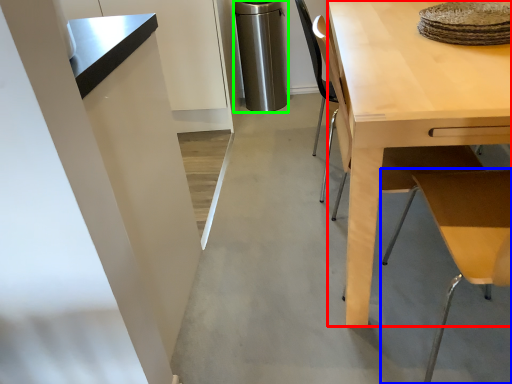
Question: Which object is the closest to the desk (highlighted by a red box)? Choose among these: table (highlighted by a blue box) or appliance (highlighted by a green box).

Choices:
 (A) table
 (B) appliance

Answer: (A)